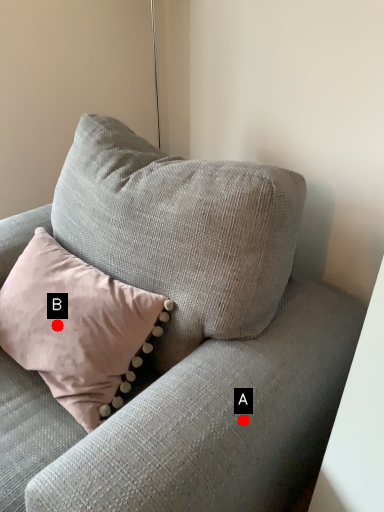
Question: Two points are circled on the image, labeled by A and B beside each circle. Which point is closer to the camera taking this photo?

Choices:
 (A) A is closer
 (B) B is closer

Answer: (A)